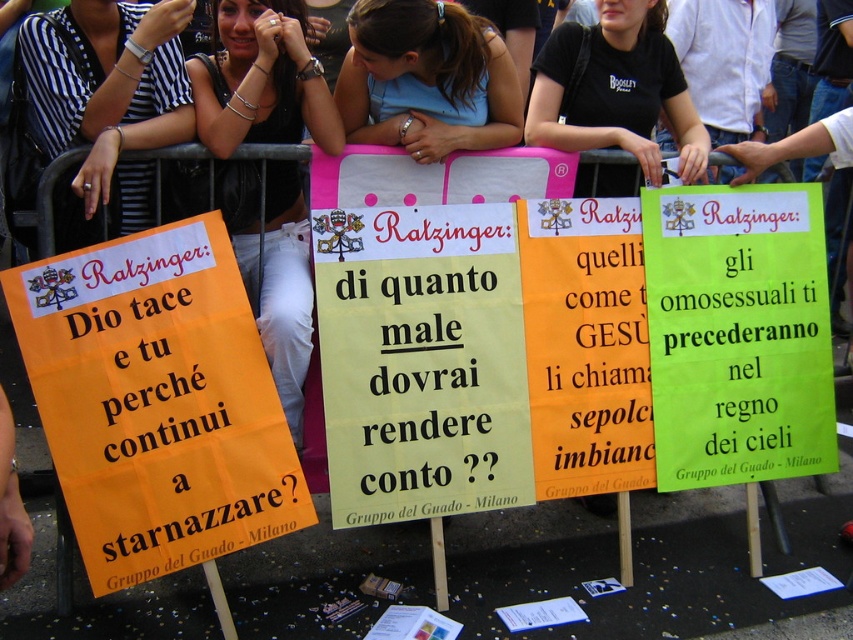
Is point (148, 532) positioned before point (596, 106)?

Yes, it is.

Describe the element at coordinates (155, 401) in the screenshot. The image size is (853, 640). I see `orange paper sign at left` at that location.

Between point (256, 435) and point (587, 164), which one is positioned behind?

The point (587, 164) is behind.

You are a GUI agent. You are given a task and a screenshot of the screen. Output one action in this format:
    pyautogui.click(x=<x>, y=<y>)
    Task: Click on the orange paper sign at left
    This screenshot has height=640, width=853.
    Given the screenshot: What is the action you would take?
    pyautogui.click(x=155, y=401)

Which is in front, point (123, 244) or point (247, 32)?

Point (123, 244) is more forward.

Between orange paper sign at left and black fabric shirt at upper center, which one appears on the right side from the viewer's perspective?

black fabric shirt at upper center is more to the right.

Between point (138, 372) and point (251, 134), which one is positioned behind?

The point (251, 134) is more distant.

Locate an element on the screen. orange paper sign at left is located at coordinates (155, 401).

Does black striped shirt at upper left appear on the left side of blue fabric shirt at center?

Indeed, black striped shirt at upper left is positioned on the left side of blue fabric shirt at center.

Can you confirm if black striped shirt at upper left is shorter than blue fabric shirt at center?

No.

Image resolution: width=853 pixels, height=640 pixels. What do you see at coordinates (108, 100) in the screenshot? I see `black striped shirt at upper left` at bounding box center [108, 100].

Image resolution: width=853 pixels, height=640 pixels. Identify the location of black striped shirt at upper left. (108, 100).